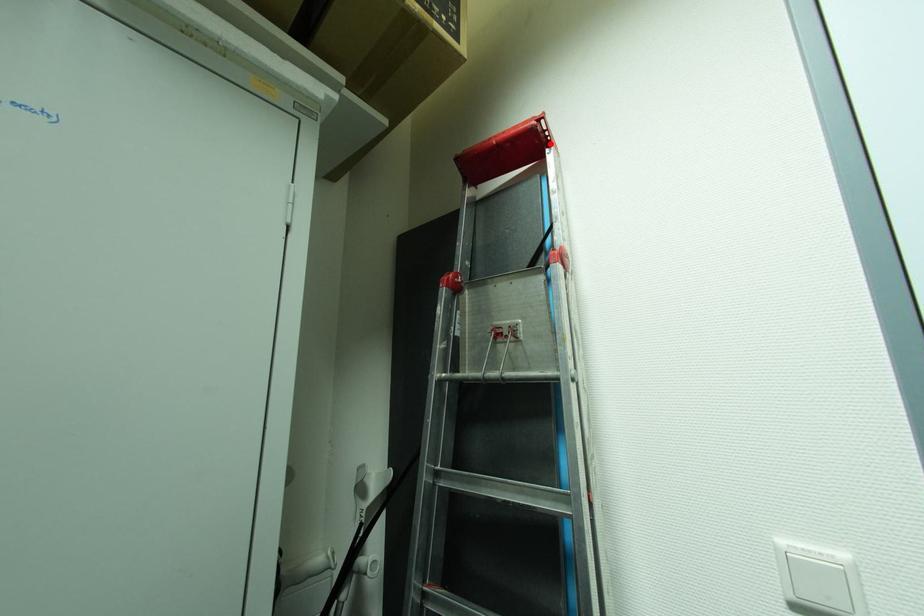
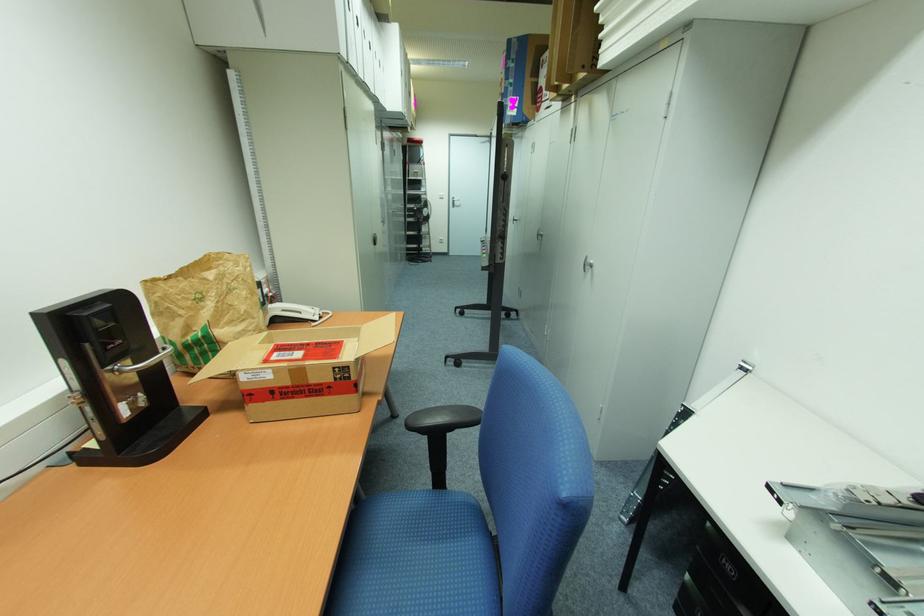
Question: I am providing you with two images of the same scene from different viewpoints. Image1 has a red point marked. In image2, the corresponding 3D location appears at what relative position? Reply with the corresponding letter.

Choices:
 (A) Closer
 (B) Farther

Answer: (A)